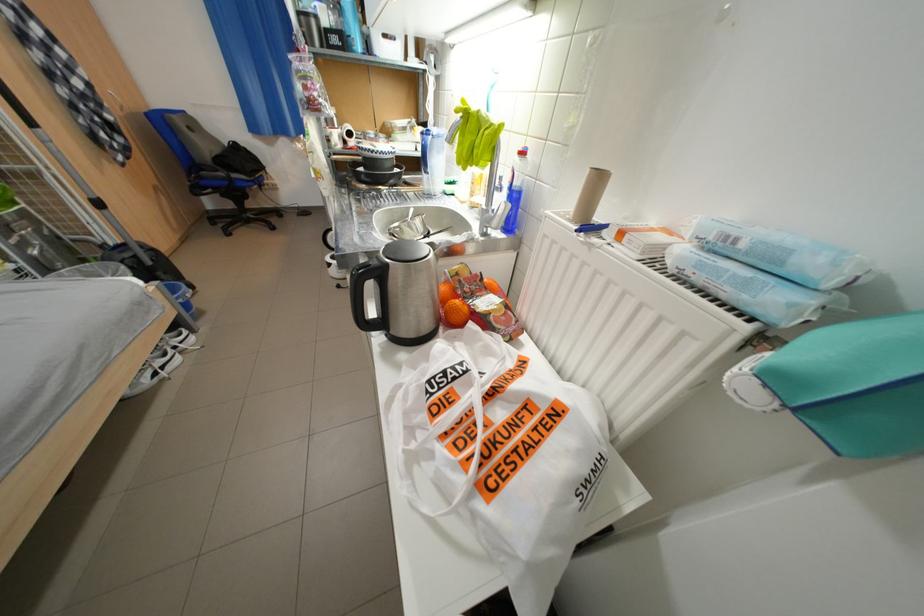
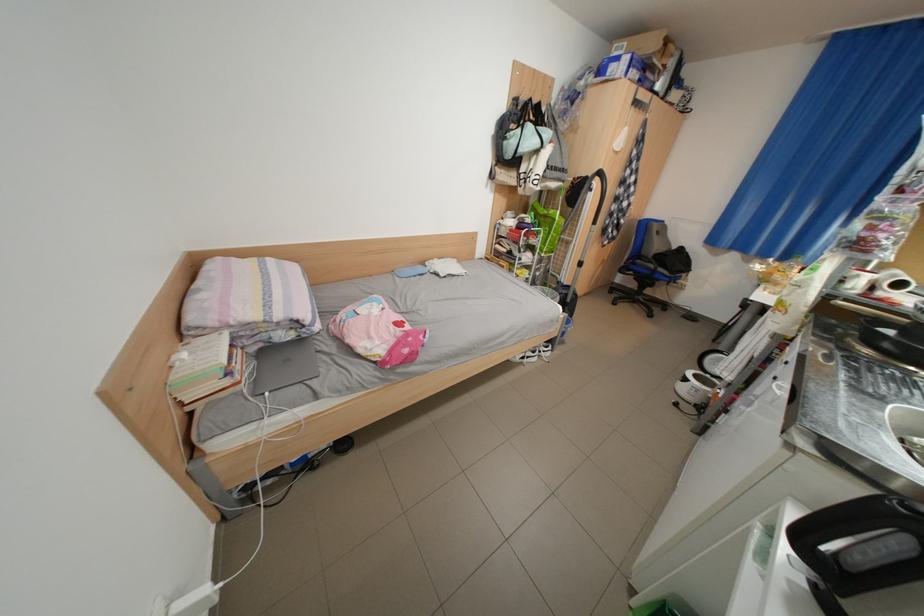
Locate, in the second image, the point that corresponds to (x=397, y=337) in the first image.

(825, 586)